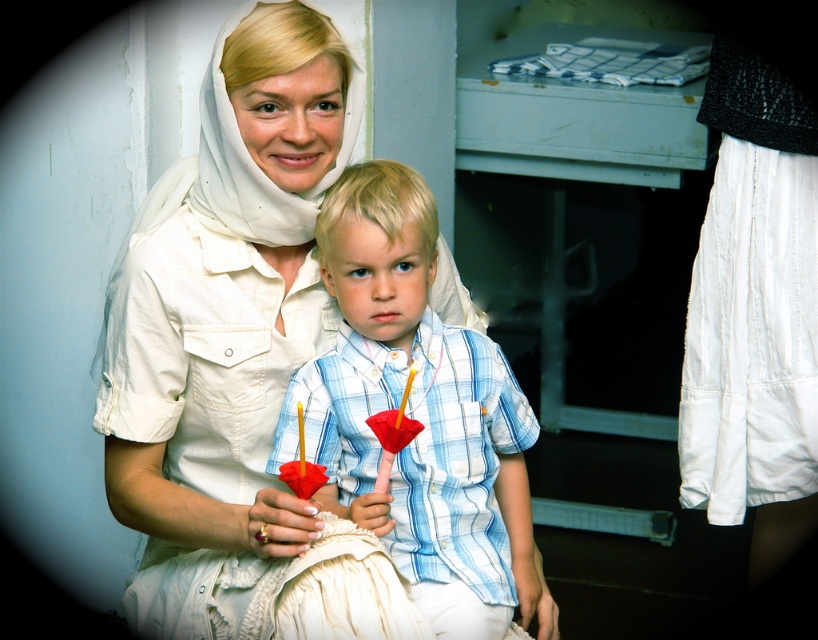
Does light blue plaid shirt at center have a larger size compared to white pleated skirt at lower right?

No.

Does point (399, 304) come farther from viewer compared to point (713, 125)?

No, it is in front of (713, 125).

This screenshot has width=818, height=640. What do you see at coordinates (418, 416) in the screenshot? I see `light blue plaid shirt at center` at bounding box center [418, 416].

Where is `light blue plaid shirt at center`? light blue plaid shirt at center is located at coordinates (418, 416).

Does white matte dress at center have a lesser height compared to light blue plaid shirt at center?

No, white matte dress at center is not shorter than light blue plaid shirt at center.

Where is `white matte dress at center`? The height and width of the screenshot is (640, 818). white matte dress at center is located at coordinates (223, 321).

The image size is (818, 640). What do you see at coordinates (223, 321) in the screenshot?
I see `white matte dress at center` at bounding box center [223, 321].

Locate an element on the screen. The image size is (818, 640). white matte dress at center is located at coordinates click(x=223, y=321).

Between point (345, 106) and point (740, 58), which one is positioned behind?

Positioned behind is point (740, 58).

Is point (286, 19) farther from camera compared to point (744, 106)?

No, it is in front of (744, 106).

Find the location of a particular element. The image size is (818, 640). white matte dress at center is located at coordinates (223, 321).

Identify the location of white matte dress at center. This screenshot has width=818, height=640. (223, 321).